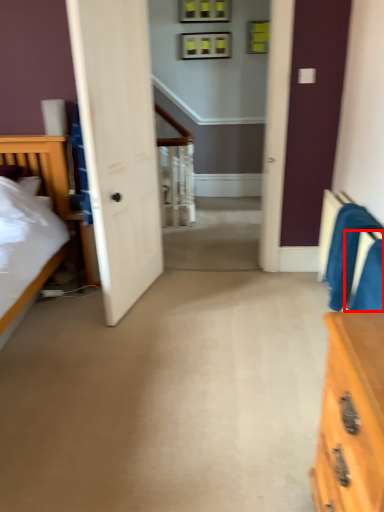
Question: From the image's perspective, what is the correct spatial relationship of armchair (annotated by the red box) in relation to armchair?

Choices:
 (A) below
 (B) above

Answer: (A)